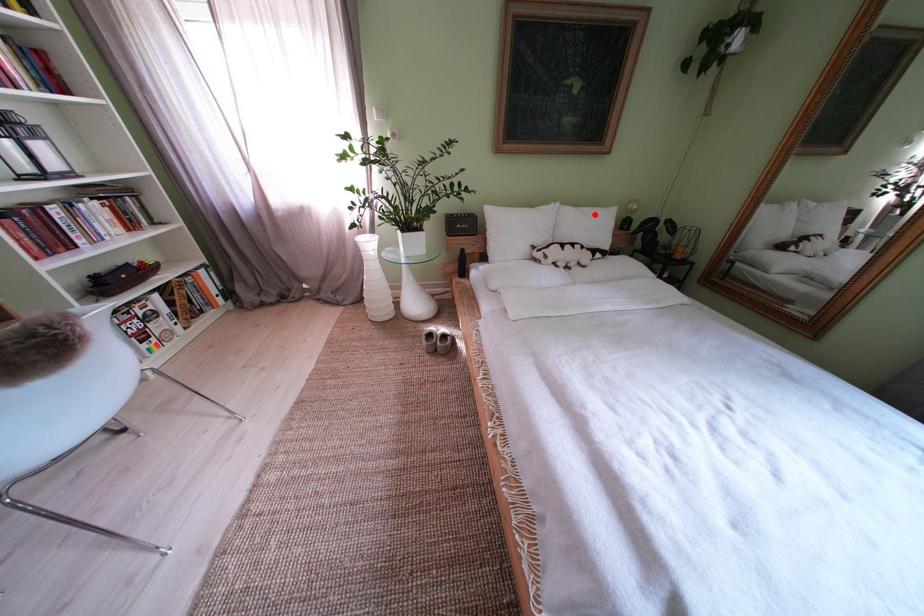
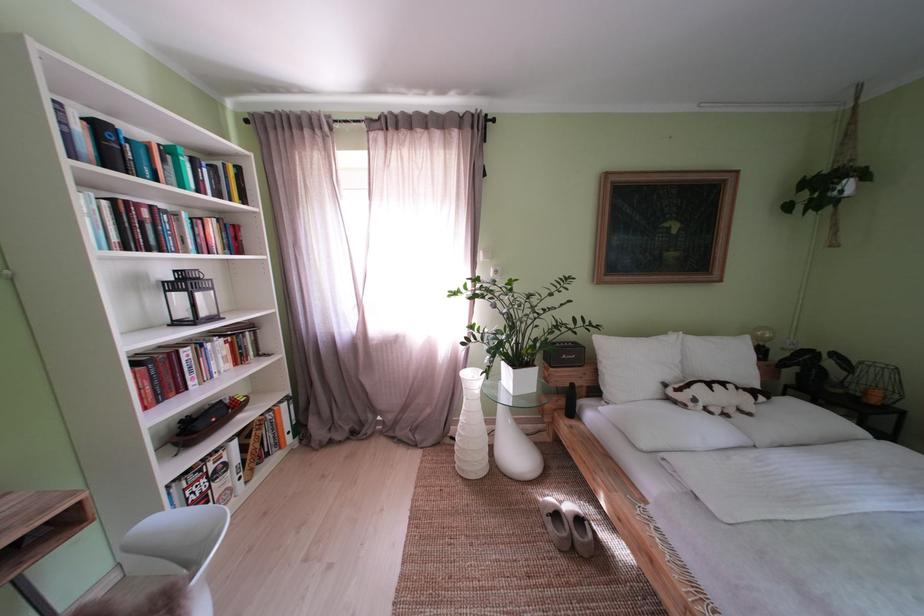
Question: I am providing you with two images of the same scene from different viewpoints. Given a red point in image1, look at the same physical point in image2. Is it:

Choices:
 (A) Closer to the viewpoint
 (B) Farther from the viewpoint

Answer: (B)